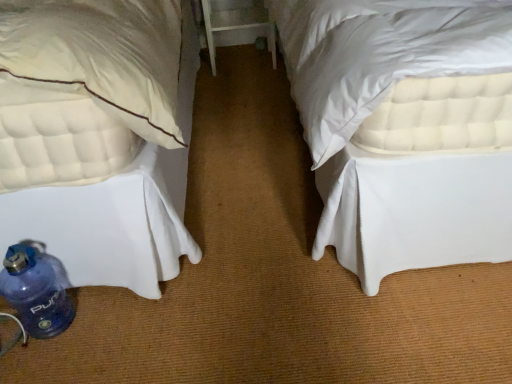
Find the location of `vacant area that is in front of white wood table at center`. vacant area that is in front of white wood table at center is located at coordinates (237, 85).